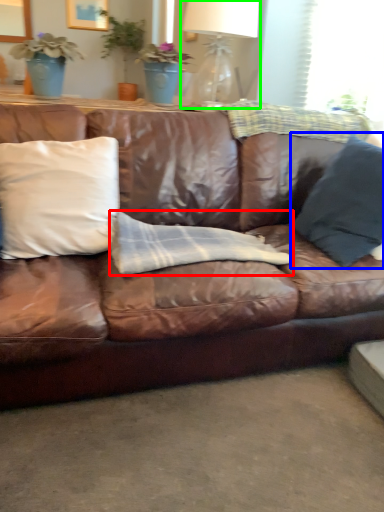
Question: Based on their relative distances, which object is farther from material (highlighted by a red box)? Choose from pillow (highlighted by a blue box) and table lamp (highlighted by a green box).

Choices:
 (A) pillow
 (B) table lamp

Answer: (B)